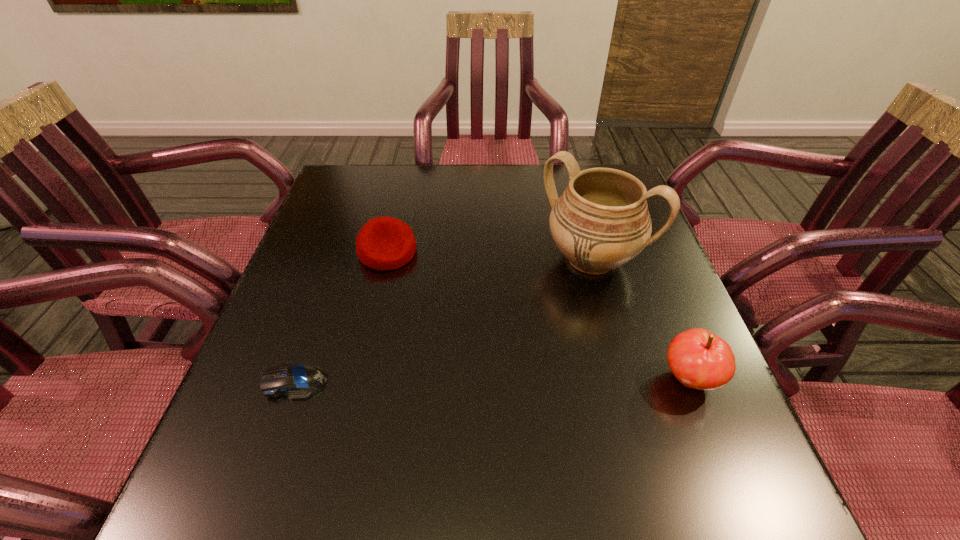
Locate an element on the screen. The image size is (960, 540). free spot between the tallest object and the shortest object is located at coordinates pos(444,320).

Identify which object is located as the nearest to the second shortest object. Please provide its 2D coordinates. Your answer should be formatted as a tuple, i.e. [(x, y)], where the tuple contains the x and y coordinates of a point satisfying the conditions above.

[(296, 380)]

Select which object is the second closest to the urn. Please provide its 2D coordinates. Your answer should be formatted as a tuple, i.e. [(x, y)], where the tuple contains the x and y coordinates of a point satisfying the conditions above.

[(384, 243)]

The width and height of the screenshot is (960, 540). I want to click on vacant region that satisfies the following two spatial constraints: 1. on the front side of the beanbag; 2. on the right side of the tallest object, so click(386, 259).

Locate an element on the screen. This screenshot has width=960, height=540. blank area in the image that satisfies the following two spatial constraints: 1. on the front side of the third tallest object; 2. on the right side of the third shortest object is located at coordinates (358, 379).